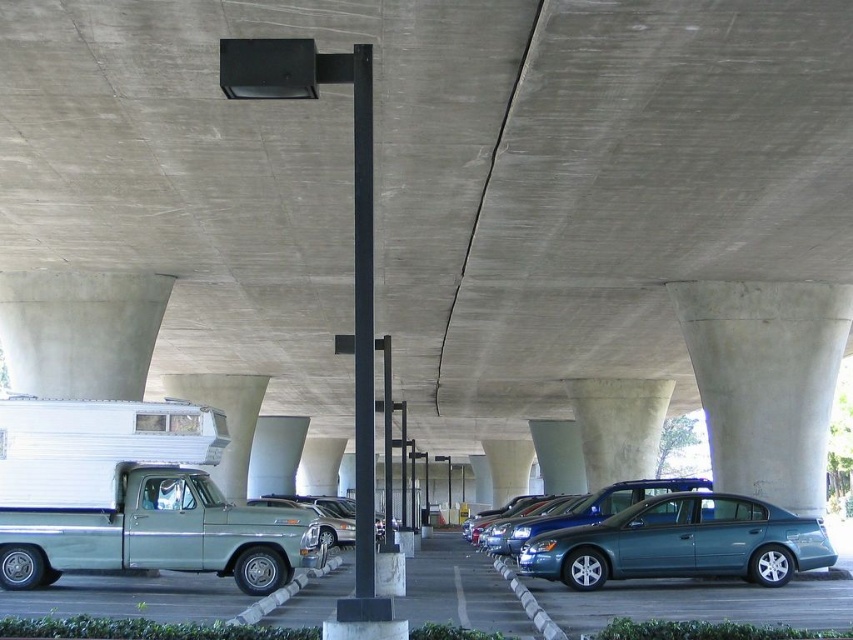
Question: Is teal metallic sedan at center to the right of metallic blue sedan at center from the viewer's perspective?

Choices:
 (A) no
 (B) yes

Answer: (A)

Question: Among these points, which one is nearest to the camera?

Choices:
 (A) (791, 518)
 (B) (640, 499)

Answer: (A)

Question: Which of the following is the farthest from the observer?

Choices:
 (A) teal metallic sedan at center
 (B) metallic blue sedan at center

Answer: (B)

Question: Is teal metallic sedan at center positioned behind metallic blue sedan at center?

Choices:
 (A) no
 (B) yes

Answer: (A)

Question: Which point is closer to the camera?

Choices:
 (A) (668, 509)
 (B) (511, 550)

Answer: (A)

Question: Does teal metallic sedan at center have a larger size compared to metallic blue sedan at center?

Choices:
 (A) no
 (B) yes

Answer: (A)